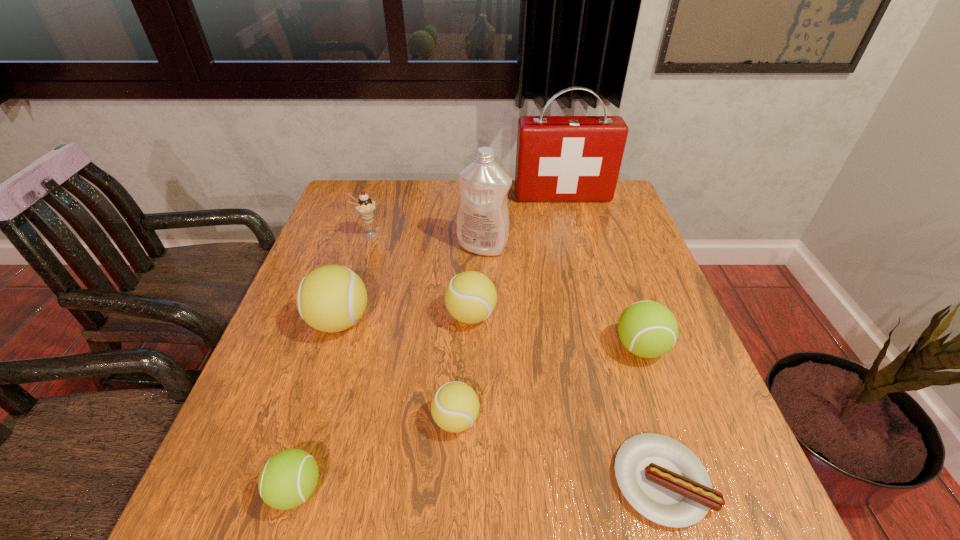
In order to click on free area in between the nearer green tennis ball and the second smallest yellow tennis ball in this screenshot , I will do `click(384, 403)`.

Locate an element on the screen. vacant area that lies between the bigger green tennis ball and the second smallest yellow tennis ball is located at coordinates (556, 332).

Locate an element on the screen. unoccupied area between the bigger green tennis ball and the icecream is located at coordinates (505, 291).

Identify the location of free space between the icecream and the second smallest yellow tennis ball. (420, 275).

This screenshot has width=960, height=540. I want to click on blank region between the red first-aid kit and the smaller green tennis ball, so click(x=429, y=343).

Find the location of a particular element. This screenshot has height=540, width=960. free space between the right green tennis ball and the second tallest object is located at coordinates (562, 297).

The height and width of the screenshot is (540, 960). I want to click on free space between the farthest object and the nearest tennis ball, so click(429, 343).

Locate an element on the screen. Image resolution: width=960 pixels, height=540 pixels. free spot between the nearest yellow tennis ball and the biggest yellow tennis ball is located at coordinates (397, 370).

This screenshot has width=960, height=540. What are the coordinates of `empty space that is in between the shortest object and the second smallest yellow tennis ball` in the screenshot? It's located at (566, 398).

The width and height of the screenshot is (960, 540). I want to click on the third closest object to the red first-aid kit, so click(x=470, y=297).